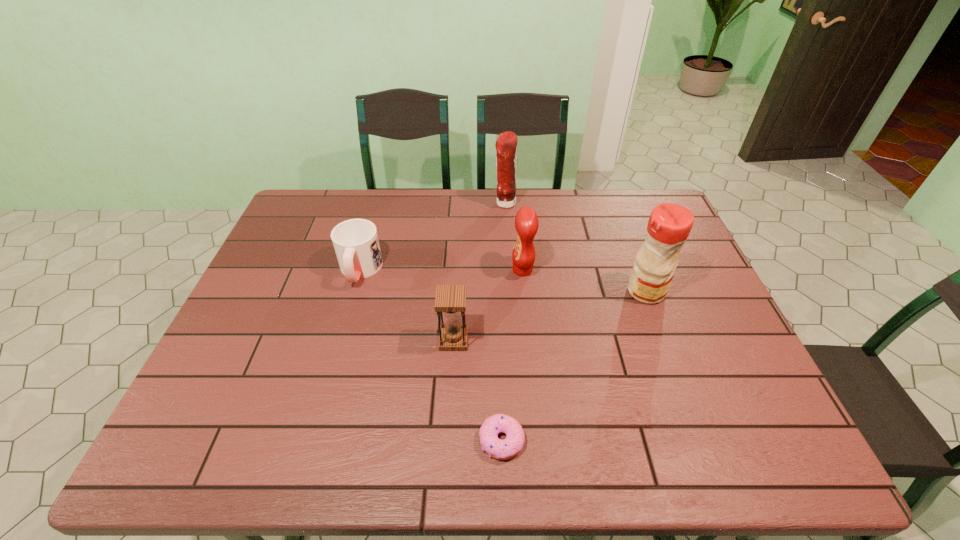
Locate an element on the screen. free spot at the far edge of the desktop is located at coordinates (434, 227).

In the image, there is a desktop. Where is `free space at the near edge`? Image resolution: width=960 pixels, height=540 pixels. free space at the near edge is located at coordinates (580, 436).

Image resolution: width=960 pixels, height=540 pixels. Find the location of `vacant area at the left edge of the desktop`. vacant area at the left edge of the desktop is located at coordinates (211, 424).

Find the location of a particular element. This screenshot has height=540, width=960. free location at the right edge is located at coordinates (688, 256).

I want to click on free space at the far left corner of the desktop, so click(311, 201).

The height and width of the screenshot is (540, 960). I want to click on free spot between the doughnut and the hourglass, so click(x=477, y=390).

Where is `empty space that is in between the farthest object and the doughnut`? The height and width of the screenshot is (540, 960). empty space that is in between the farthest object and the doughnut is located at coordinates 503,322.

In order to click on free space between the mug and the farthest condiment in this screenshot , I will do `click(432, 237)`.

This screenshot has height=540, width=960. In order to click on free space between the fifth object from right to left and the nearest object in this screenshot , I will do pos(477,390).

At what (x,y) coordinates should I click in order to perform the action: click on vacant point located between the nearest object and the hourglass. Please return your answer as a coordinate pair (x, y). Looking at the image, I should click on (477, 390).